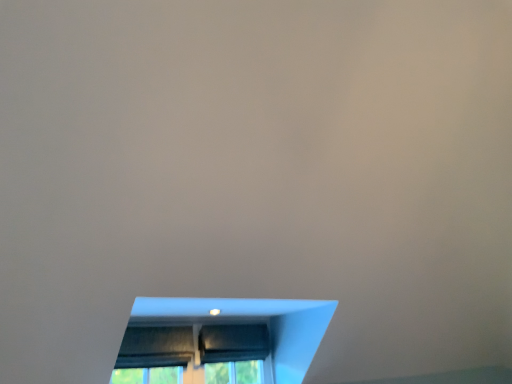
Question: Should I look upward or downward to see black matte curtain at center?

Choices:
 (A) up
 (B) down

Answer: (B)